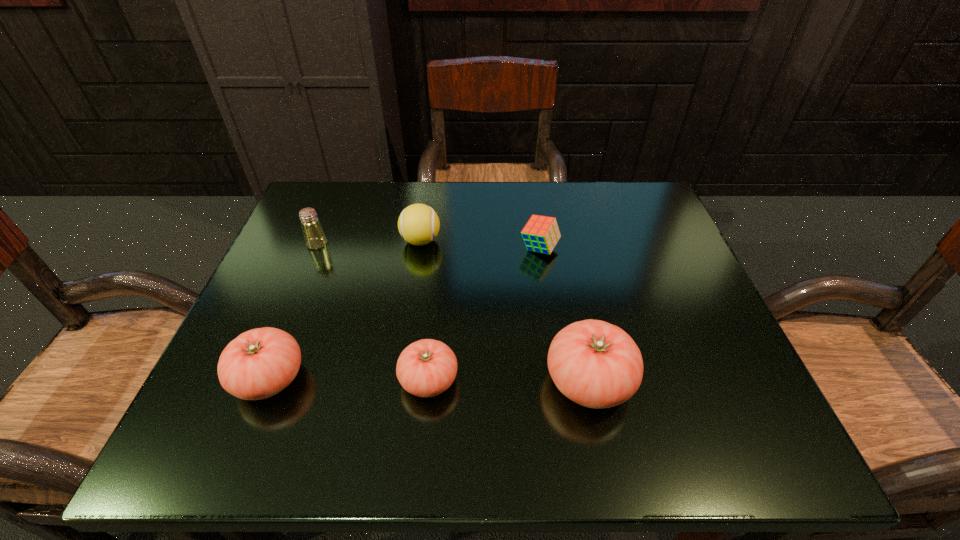
At what (x,y) coordinates should I click in order to perform the action: click on free spot between the saltshaker and the tallest tomato. Please return your answer as a coordinate pair (x, y). Looking at the image, I should click on (453, 313).

Where is `empty location between the leftmost tomato and the tennis ball`? empty location between the leftmost tomato and the tennis ball is located at coordinates (346, 309).

Image resolution: width=960 pixels, height=540 pixels. What are the coordinates of `free space between the shortest tomato and the saltshaker` in the screenshot? It's located at (373, 312).

At what (x,y) coordinates should I click in order to perform the action: click on free space between the rightmost tomato and the shortest tomato. Please return your answer as a coordinate pair (x, y). Looking at the image, I should click on (509, 381).

At what (x,y) coordinates should I click in order to perform the action: click on vacant area that lies between the leftmost tomato and the tennis ball. Please return your answer as a coordinate pair (x, y). Looking at the image, I should click on (346, 309).

Find the location of `object that ranks as the third closest to the tennis ball`. object that ranks as the third closest to the tennis ball is located at coordinates (426, 368).

I want to click on object that is the third closest to the second tomato from right to left, so click(418, 224).

Locate which tomato is the second closest to the cube. Please provide its 2D coordinates. Your answer should be formatted as a tuple, i.e. [(x, y)], where the tuple contains the x and y coordinates of a point satisfying the conditions above.

[(426, 368)]

In order to click on tomato identified as the closest to the second tallest tomato in this screenshot , I will do `click(426, 368)`.

Where is `free region that satisfies the following two spatial constraints: 1. on the front side of the tallest object; 2. on the right side of the cube`? The height and width of the screenshot is (540, 960). free region that satisfies the following two spatial constraints: 1. on the front side of the tallest object; 2. on the right side of the cube is located at coordinates (560, 381).